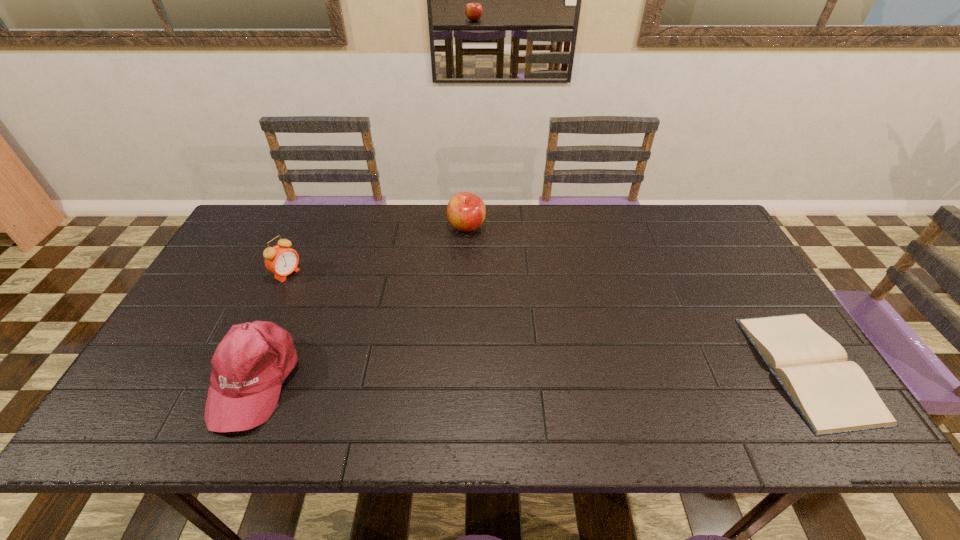
This screenshot has width=960, height=540. Identify the location of free spot on the desktop that is between the baseball cap and the rightmost object and is positioned on the stem of the farthest object. (499, 374).

Identify the location of vacant space on the desktop that is between the baseball cap and the Bible and is positioned on the face of the alarm clock. This screenshot has height=540, width=960. (467, 375).